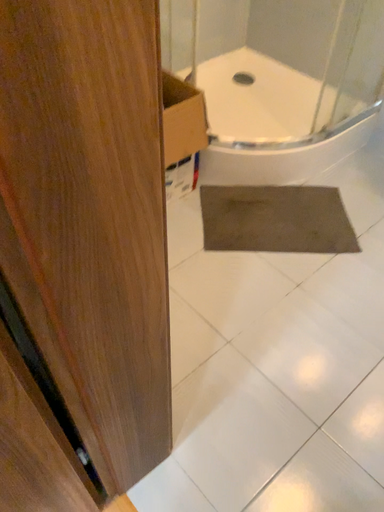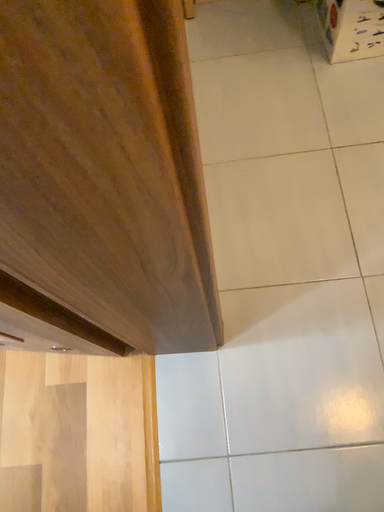
Question: How did the camera likely rotate when shooting the video?

Choices:
 (A) rotated left
 (B) rotated right

Answer: (A)